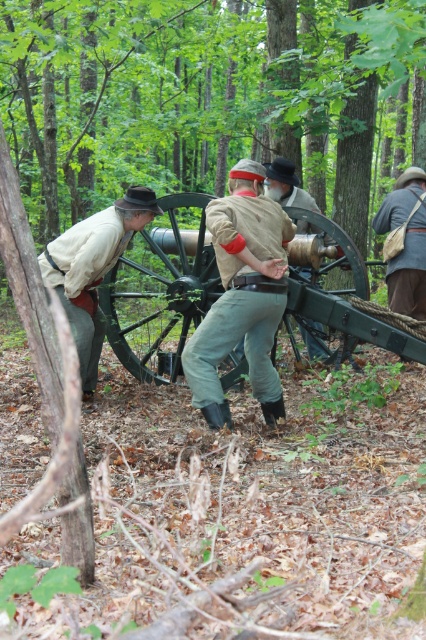
Does black matte cannon at center have a larger size compared to light brown leather jacket at center?

Yes, black matte cannon at center is bigger than light brown leather jacket at center.

In the scene shown: Does black matte cannon at center lie behind light brown leather jacket at center?

No, it is not.

Based on the photo, who is more forward, (132, 292) or (314, 324)?

Positioned in front is point (132, 292).

Locate an element on the screen. black matte cannon at center is located at coordinates (161, 289).

Between black matte cannon at center and brown canvas bag at right, which one appears on the left side from the viewer's perspective?

black matte cannon at center

Can you confirm if black matte cannon at center is positioned to the left of brown canvas bag at right?

Yes, black matte cannon at center is to the left of brown canvas bag at right.

Who is more distant from viewer, (138, 280) or (405, 209)?

Point (138, 280)

What are the coordinates of `black matte cannon at center` in the screenshot? It's located at (161, 289).

Which of these two, black matte cannon at center or light brown leather pants at center, stands taller?

black matte cannon at center

Does black matte cannon at center appear over light brown leather pants at center?

Yes.

Identify the location of black matte cannon at center. The image size is (426, 640). (161, 289).

Where is `black matte cannon at center`? black matte cannon at center is located at coordinates (161, 289).